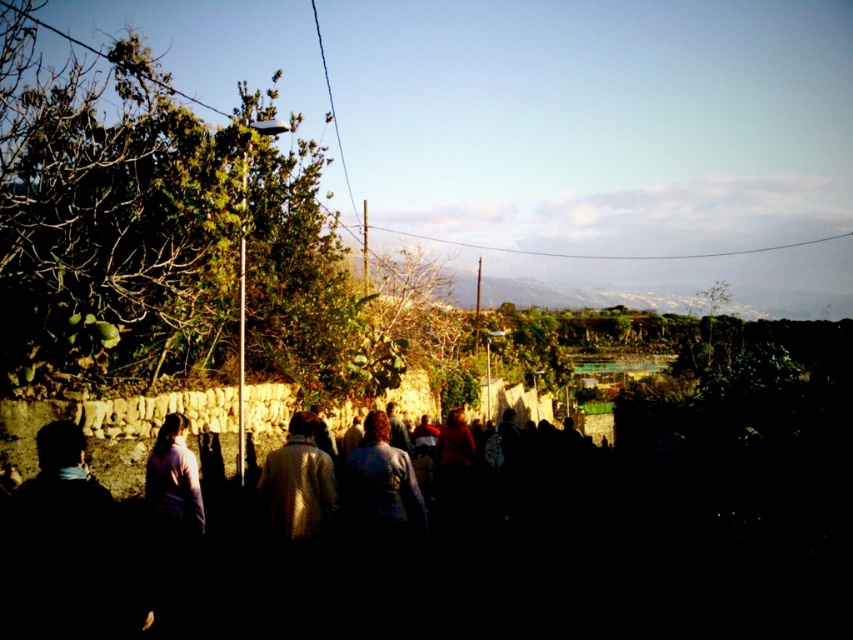
You are standing at the point marked as point (376, 461) in the scene. If you want to walk back to the starting point which is 50 feet away from you, how many more feet do you need to walk?

The distance of point (376, 461) from viewer is 30.14 feet, so you need to walk 50 minus 30.14 equals 19.86 feet more to reach the starting point.

You are a photographer trying to capture the group of people walking along the path. You notice two jackets in the scene. Which jacket is positioned higher up in the image, the shiny metallic jacket at center or the blue fabric jacket at center?

The shiny metallic jacket at center is positioned higher up in the image than the blue fabric jacket at center.